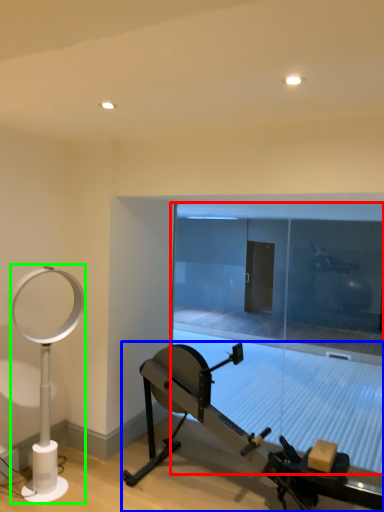
Question: Which object is positioned farthest from glass door (highlighted by a red box)? Select from stationary bicycle (highlighted by a blue box) and table lamp (highlighted by a green box).

Choices:
 (A) stationary bicycle
 (B) table lamp

Answer: (B)